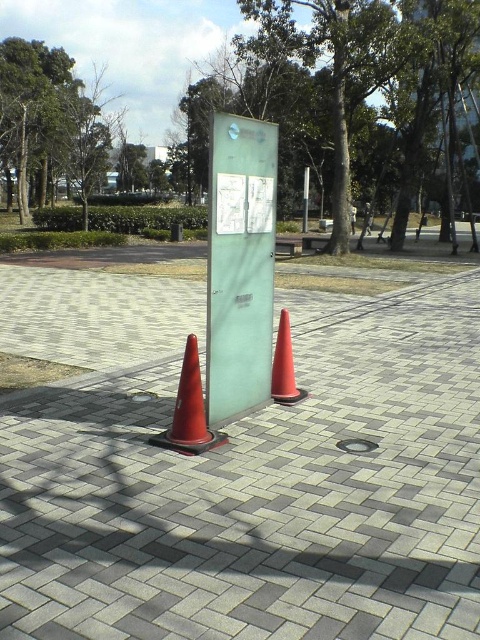
Who is more forward, (287,320) or (307,186)?

Point (287,320)

From the picture: Does orange matte traffic cone at center appear under silver metallic pole at center?

Yes, orange matte traffic cone at center is below silver metallic pole at center.

This screenshot has height=640, width=480. I want to click on orange matte traffic cone at center, so click(285, 365).

Where is `orange matte traffic cone at center`? The image size is (480, 640). orange matte traffic cone at center is located at coordinates (285, 365).

In the scene shown: Between gray brick pavement at center and silver metallic pole at center, which one appears on the right side from the viewer's perspective?

From the viewer's perspective, silver metallic pole at center appears more on the right side.

Who is taller, gray brick pavement at center or silver metallic pole at center?

silver metallic pole at center

Between point (160, 513) and point (307, 225), which one is positioned in front?

Point (160, 513) is in front.

Where is `gray brick pavement at center`? The image size is (480, 640). gray brick pavement at center is located at coordinates (261, 493).

Measure the distance from green glass sign at center to silver metallic pole at center.

24.05 meters

Does green glass sign at center have a smaller size compared to silver metallic pole at center?

No, green glass sign at center is not smaller than silver metallic pole at center.

Identify the location of green glass sign at center. (240, 266).